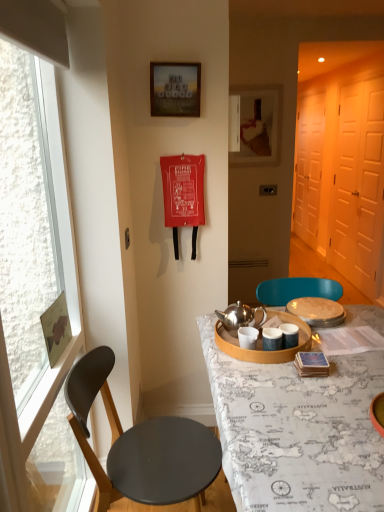
Locate an element on the screen. The height and width of the screenshot is (512, 384). vacant space in front of silver metallic teapot at center, which is counted as the first tableware, starting from the left is located at coordinates (288, 392).